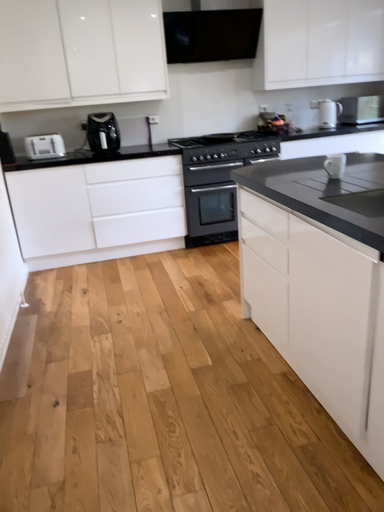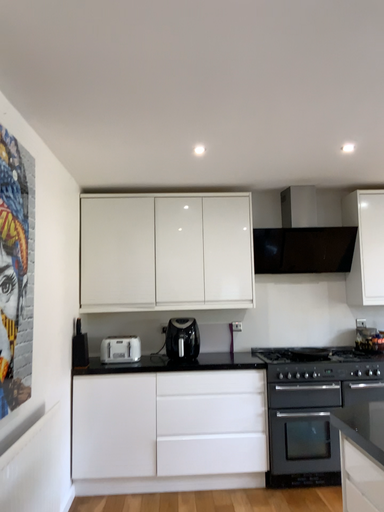
Question: Which way did the camera rotate in the video?

Choices:
 (A) rotated left
 (B) rotated right

Answer: (A)